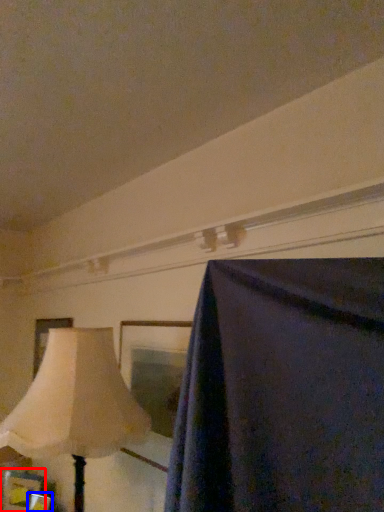
Question: Among these objects, which one is farthest to the camera, picture frame (highlighted by a red box) or picture frame (highlighted by a blue box)?

Choices:
 (A) picture frame
 (B) picture frame

Answer: (A)